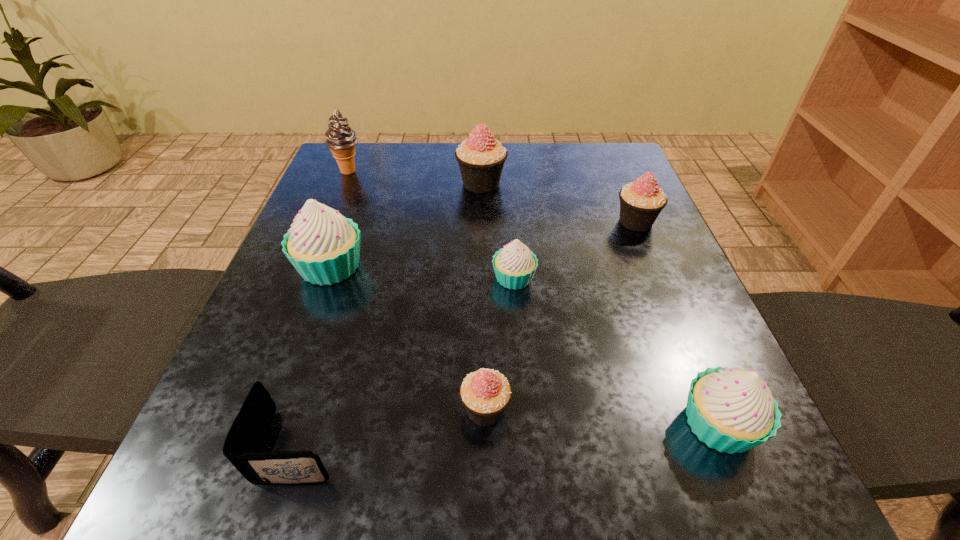
I want to click on chocolate icecream, so click(x=341, y=139).

This screenshot has width=960, height=540. What are the coordinates of `the biggest pink cupcake` in the screenshot? It's located at (481, 158).

Find the location of a particular element. The width and height of the screenshot is (960, 540). the farthest pink cupcake is located at coordinates (481, 158).

Image resolution: width=960 pixels, height=540 pixels. I want to click on the leftmost cupcake, so click(323, 246).

In order to click on the biggest white cupcake in this screenshot , I will do [x=323, y=246].

In order to click on the sixth nearest object in this screenshot , I will do `click(641, 202)`.

Image resolution: width=960 pixels, height=540 pixels. Identify the location of the rightmost pink cupcake. pyautogui.click(x=641, y=202).

Identify the location of the nearest white cupcake. (732, 410).

Identify the location of the rightmost white cupcake. This screenshot has width=960, height=540. (732, 410).

The height and width of the screenshot is (540, 960). Find the location of `the smallest white cupcake`. the smallest white cupcake is located at coordinates (514, 265).